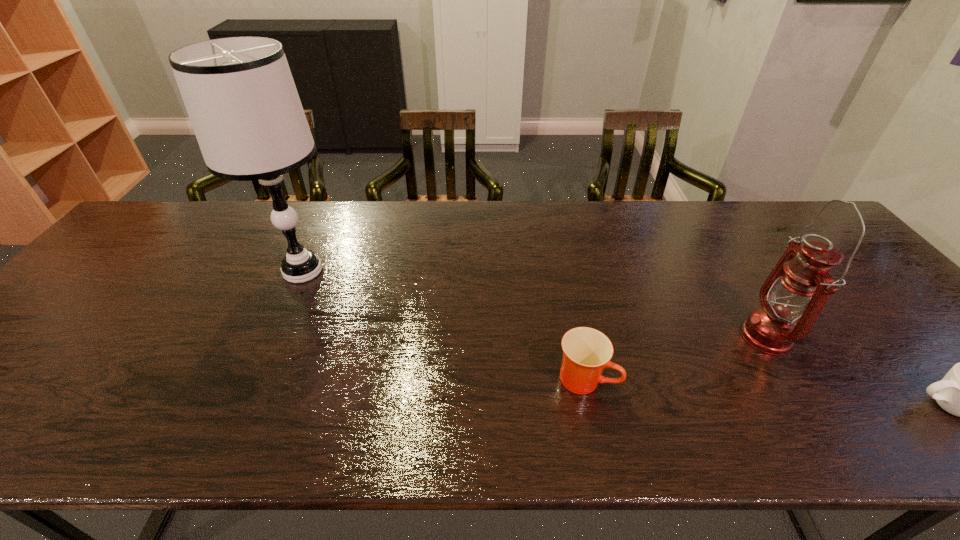
This screenshot has height=540, width=960. I want to click on vacant region at the near edge of the desktop, so click(x=144, y=441).

At what (x,y) coordinates should I click in order to perform the action: click on blank space at the right edge. Please return your answer as a coordinate pair (x, y). The image size is (960, 540). Looking at the image, I should click on (887, 358).

Where is `vacant space at the far right corner`? vacant space at the far right corner is located at coordinates (777, 215).

Locate an element on the screen. This screenshot has width=960, height=540. vacant space that is in between the second shortest object and the third shortest object is located at coordinates (675, 357).

This screenshot has width=960, height=540. I want to click on empty location between the farthest object and the second shortest object, so click(x=444, y=325).

Identify the location of free space between the taller cup and the third shortest object. This screenshot has height=540, width=960. (675, 357).

Locate an element on the screen. blank region between the second tallest object and the third tallest object is located at coordinates (675, 357).

Locate an element on the screen. This screenshot has width=960, height=540. object that stands as the second closest to the table lamp is located at coordinates (799, 286).

This screenshot has width=960, height=540. Find the location of `object that is the nearest to the shorter cup`. object that is the nearest to the shorter cup is located at coordinates (799, 286).

Locate an element on the screen. free space in the image that satisfies the following two spatial constraints: 1. on the front side of the farthest object; 2. on the right side of the left cup is located at coordinates (254, 379).